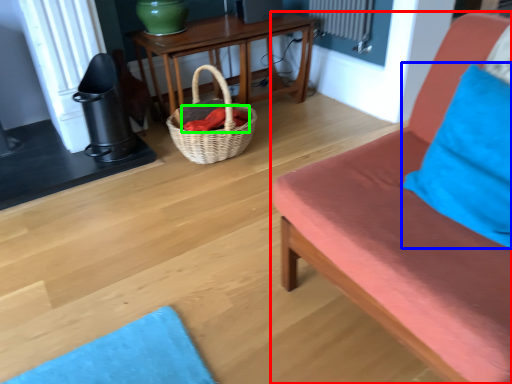
Question: Which is farther away from studio couch (highlighted by a red box)? pillow (highlighted by a blue box) or material (highlighted by a green box)?

Choices:
 (A) pillow
 (B) material

Answer: (B)